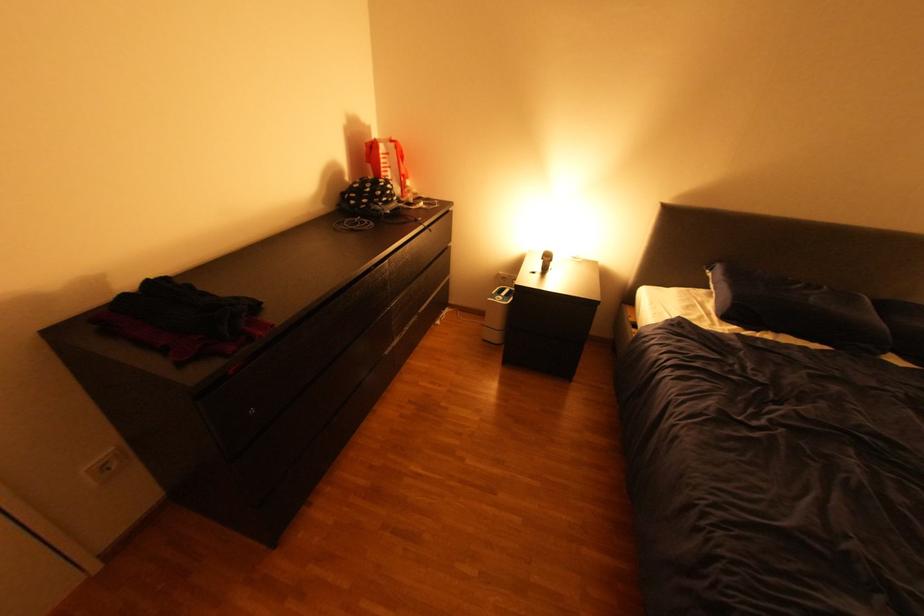
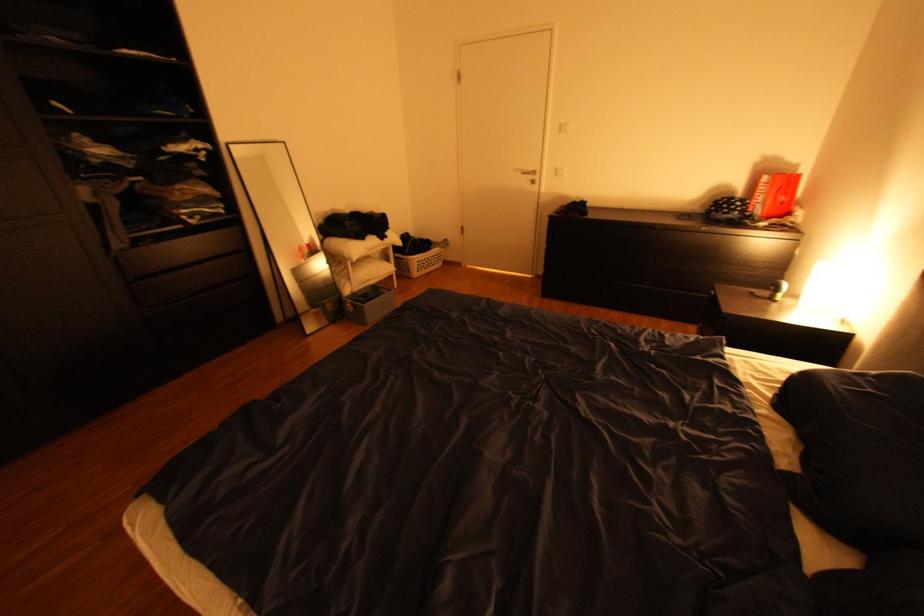
Locate, in the second image, the point that corresponds to [402,192] in the first image.

(748, 208)